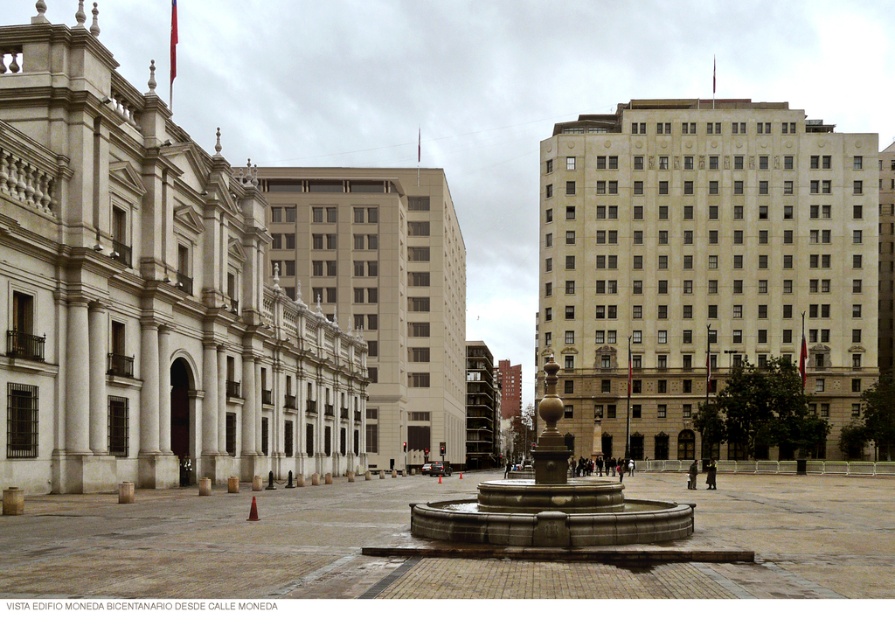
Question: Is beige stone building at center positioned at the back of granite fountain at center?

Choices:
 (A) yes
 (B) no

Answer: (A)

Question: Among these objects, which one is nearest to the camera?

Choices:
 (A) granite fountain at center
 (B) beige stone building at center

Answer: (A)

Question: Is beige stone building at center bigger than granite fountain at center?

Choices:
 (A) no
 (B) yes

Answer: (B)

Question: Does beige stone building at center have a greater width compared to granite fountain at center?

Choices:
 (A) yes
 (B) no

Answer: (A)